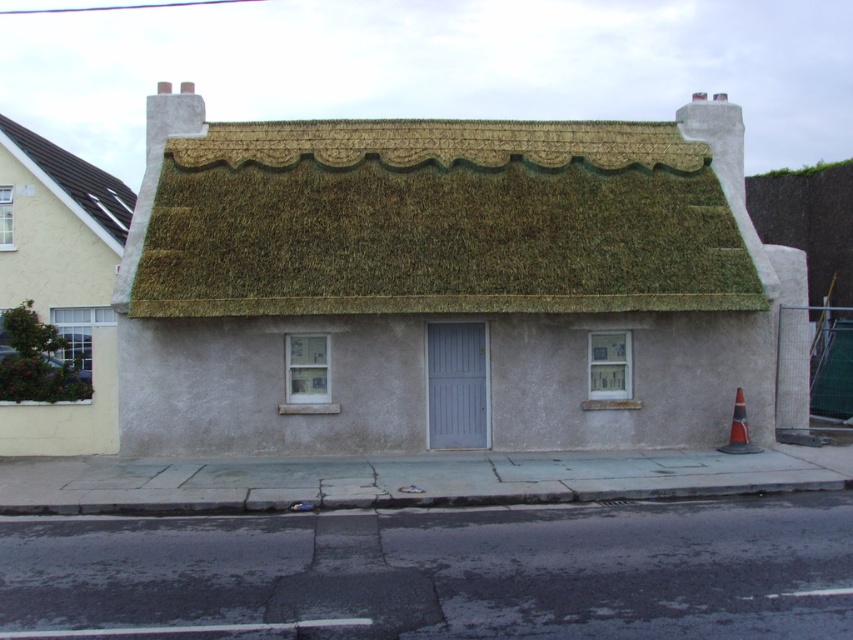
Question: Is thatched roof cottage at center closer to the viewer compared to dark brown shingles at upper left?

Choices:
 (A) yes
 (B) no

Answer: (A)

Question: Which is farther from the thatched roof cottage at center?

Choices:
 (A) matte white house at left
 (B) dark brown shingles at upper left

Answer: (B)

Question: Which is farther from the matte white house at left?

Choices:
 (A) thatched roof cottage at center
 (B) dark brown shingles at upper left

Answer: (A)

Question: Which object appears farthest from the camera in this image?

Choices:
 (A) dark brown shingles at upper left
 (B) matte white house at left

Answer: (A)

Question: Is thatched roof cottage at center further to the viewer compared to dark brown shingles at upper left?

Choices:
 (A) no
 (B) yes

Answer: (A)

Question: Does thatched roof cottage at center appear on the left side of matte white house at left?

Choices:
 (A) yes
 (B) no

Answer: (B)